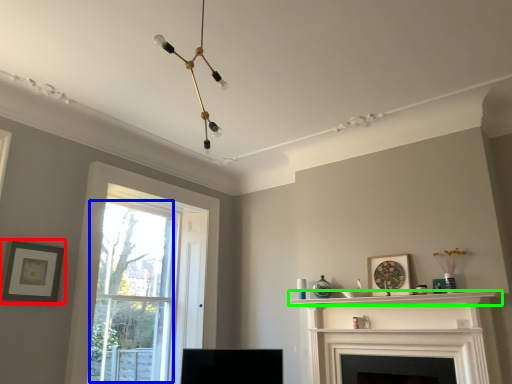
Question: Which is nearer to the picture frame (highlighted by a red box)? bay window (highlighted by a blue box) or shelf (highlighted by a green box).

Choices:
 (A) bay window
 (B) shelf

Answer: (A)